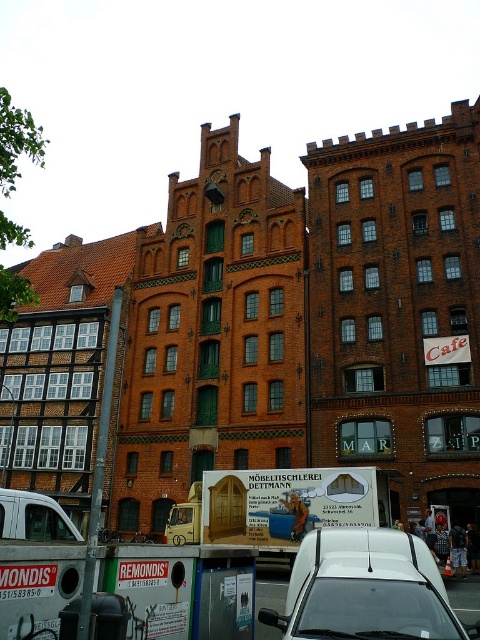
You are a delivery driver who needs to back out of a parking spot between two historic buildings. You see a white matte van at center and a white matte van at lower left. Which van is blocking your path more directly?

The white matte van at center is blocking your path more directly because it is in front of the white matte van at lower left, making it closer to your current position.

You are a delivery driver who needs to park your van in this area. There is already a white matte van at center and a white matte van at lower left parked here. Can you safely park another van between them without overlapping?

The distance between the white matte van at center and the white matte van at lower left is 13.94 meters. Assuming a standard van is about 6 meters long, there is enough space between them to park another van without overlapping.

You are standing at the point with coordinates point (364, 580) and want to walk to the point with coordinates point (39, 515). According to the image, will you have to go around any obstacles between these two points?

Point (364, 580) is in front of point (39, 515), so you will have to go around the obstacle between them.